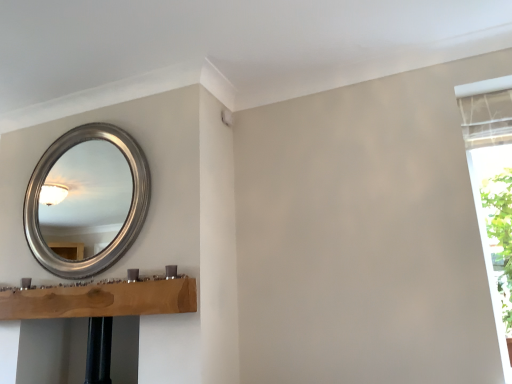
Question: Is white fabric curtain at right to the left of silver metallic mirror at upper left from the viewer's perspective?

Choices:
 (A) no
 (B) yes

Answer: (A)

Question: From the image's perspective, does white fabric curtain at right appear higher than silver metallic mirror at upper left?

Choices:
 (A) no
 (B) yes

Answer: (A)

Question: From the image's perspective, would you say white fabric curtain at right is shown under silver metallic mirror at upper left?

Choices:
 (A) yes
 (B) no

Answer: (A)

Question: Considering the relative positions of white fabric curtain at right and silver metallic mirror at upper left in the image provided, is white fabric curtain at right to the right of silver metallic mirror at upper left from the viewer's perspective?

Choices:
 (A) no
 (B) yes

Answer: (B)

Question: Is white fabric curtain at right positioned beyond the bounds of silver metallic mirror at upper left?

Choices:
 (A) yes
 (B) no

Answer: (A)

Question: Is white fabric curtain at right bigger than silver metallic mirror at upper left?

Choices:
 (A) yes
 (B) no

Answer: (A)

Question: Can you confirm if silver metallic mirror at upper left is bigger than white fabric curtain at right?

Choices:
 (A) yes
 (B) no

Answer: (B)

Question: Is silver metallic mirror at upper left thinner than white fabric curtain at right?

Choices:
 (A) yes
 (B) no

Answer: (A)

Question: Is silver metallic mirror at upper left far from white fabric curtain at right?

Choices:
 (A) no
 (B) yes

Answer: (B)

Question: From the image's perspective, is silver metallic mirror at upper left located beneath white fabric curtain at right?

Choices:
 (A) no
 (B) yes

Answer: (A)

Question: From a real-world perspective, is silver metallic mirror at upper left on white fabric curtain at right?

Choices:
 (A) no
 (B) yes

Answer: (B)

Question: Does silver metallic mirror at upper left have a smaller size compared to white fabric curtain at right?

Choices:
 (A) no
 (B) yes

Answer: (B)

Question: Considering the positions of silver metallic mirror at upper left and white fabric curtain at right in the image, is silver metallic mirror at upper left bigger or smaller than white fabric curtain at right?

Choices:
 (A) big
 (B) small

Answer: (B)